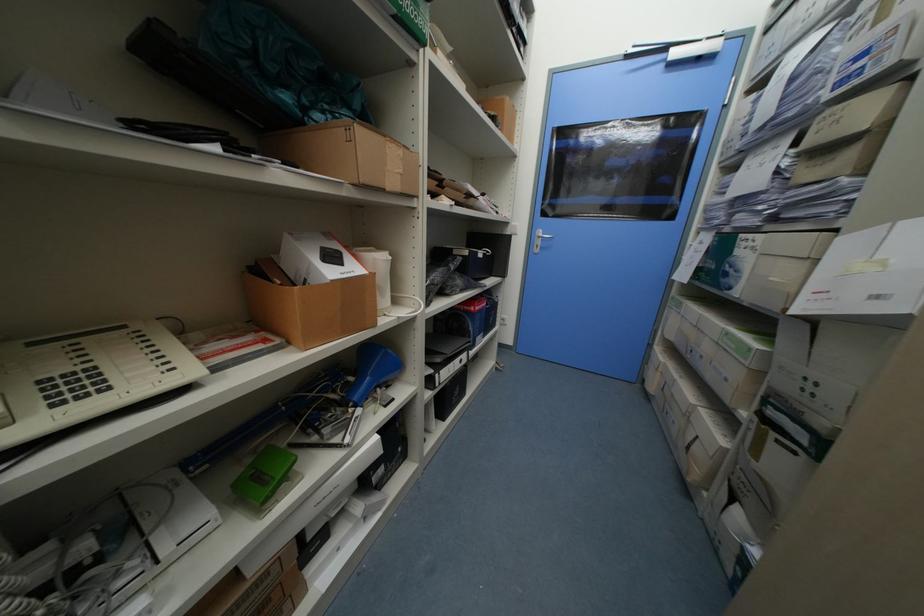
Where is `green stapler`? green stapler is located at coordinates (263, 475).